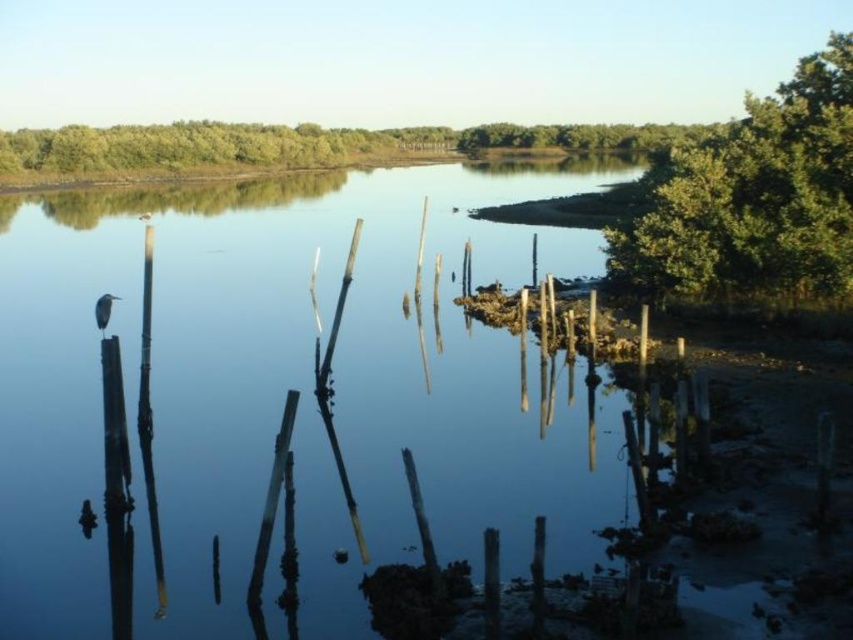
Is smooth water at center thinner than green leafy tree at upper right?

No.

Between point (398, 180) and point (810, 124), which one is positioned in front?

Point (810, 124) is more forward.

Where is `smooth water at center`? smooth water at center is located at coordinates (285, 392).